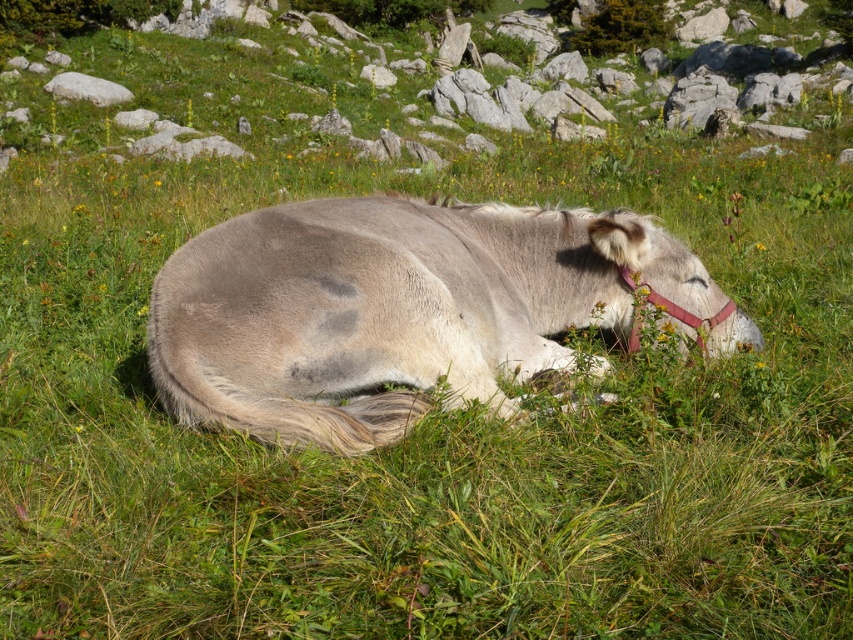
Can you confirm if green grassy hillside at upper center is smaller than white smooth rock at upper left?

Actually, green grassy hillside at upper center might be larger than white smooth rock at upper left.

Between green grassy hillside at upper center and white smooth rock at upper left, which one has less height?

white smooth rock at upper left is shorter.

Between point (735, 67) and point (62, 93), which one is positioned in front?

Point (62, 93)

At what (x,y) coordinates should I click in order to perform the action: click on green grassy hillside at upper center. Please return your answer as a coordinate pair (x, y). This screenshot has width=853, height=640. Looking at the image, I should click on (409, 81).

This screenshot has width=853, height=640. Identify the location of green grassy hillside at upper center. (409, 81).

Does green grassy hillside at upper center have a greater height compared to gray soft fur donkey at center?

Indeed, green grassy hillside at upper center has a greater height compared to gray soft fur donkey at center.

At what (x,y) coordinates should I click in order to perform the action: click on green grassy hillside at upper center. Please return your answer as a coordinate pair (x, y). The width and height of the screenshot is (853, 640). Looking at the image, I should click on (409, 81).

Find the location of a particular element. This screenshot has height=640, width=853. green grassy hillside at upper center is located at coordinates (409, 81).

Which is more to the left, gray soft fur donkey at center or white smooth rock at upper left?

From the viewer's perspective, white smooth rock at upper left appears more on the left side.

Is point (398, 305) behind point (88, 93)?

No, it is not.

Locate an element on the screen. The height and width of the screenshot is (640, 853). gray soft fur donkey at center is located at coordinates (399, 310).

Where is `gray soft fur donkey at center`? gray soft fur donkey at center is located at coordinates (399, 310).